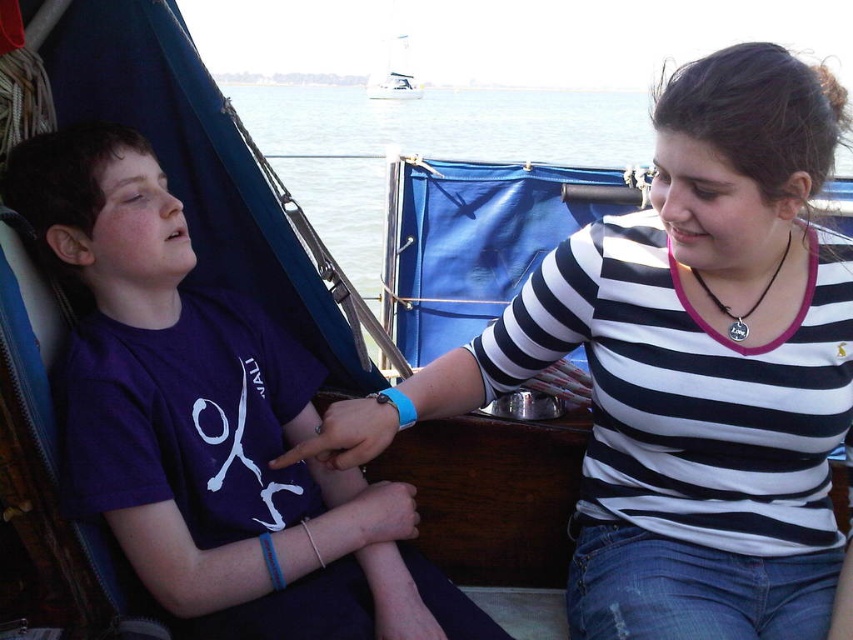
Question: In this image, where is purple cotton shirt at left located relative to white sailboat at upper center?

Choices:
 (A) above
 (B) below

Answer: (B)

Question: Which point appears closest to the camera in this image?

Choices:
 (A) (769, 276)
 (B) (432, 317)
 (C) (85, 461)
 (D) (556, 289)

Answer: (C)

Question: Can you confirm if striped cotton shirt at center is positioned below clear water at upper center?

Choices:
 (A) no
 (B) yes

Answer: (B)

Question: Does clear water at upper center appear on the left side of white sailboat at upper center?

Choices:
 (A) no
 (B) yes

Answer: (A)

Question: Which is farther from the clear water at upper center?

Choices:
 (A) white sailboat at upper center
 (B) black leather necklace at center
 (C) striped cotton shirt at center
 (D) purple cotton shirt at left

Answer: (D)

Question: Which object is positioned farthest from the purple cotton shirt at left?

Choices:
 (A) clear water at upper center
 (B) white sailboat at upper center
 (C) black leather necklace at center
 (D) striped cotton shirt at center

Answer: (A)